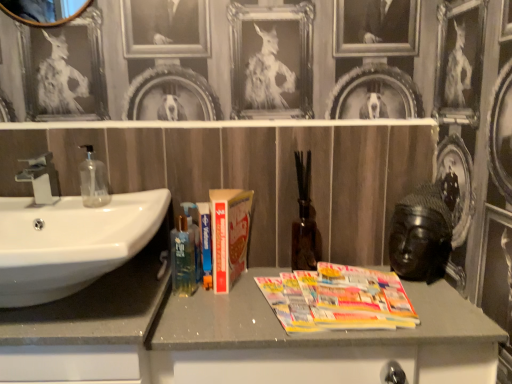
Locate an element on the screen. The width and height of the screenshot is (512, 384). free location in front of hardcover book at center is located at coordinates (224, 312).